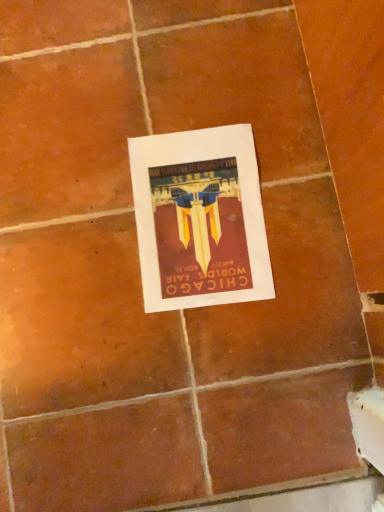
Identify the location of empty space that is ontop of matte paper poster at center (from a real-world perspective). (198, 218).